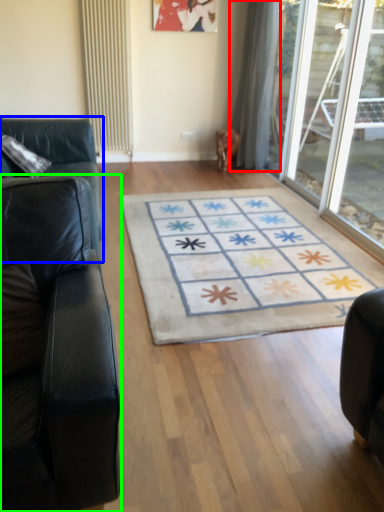
Question: Which object is the farthest from curtain (highlighted by a red box)? Choose among these: studio couch (highlighted by a blue box) or studio couch (highlighted by a green box).

Choices:
 (A) studio couch
 (B) studio couch

Answer: (B)